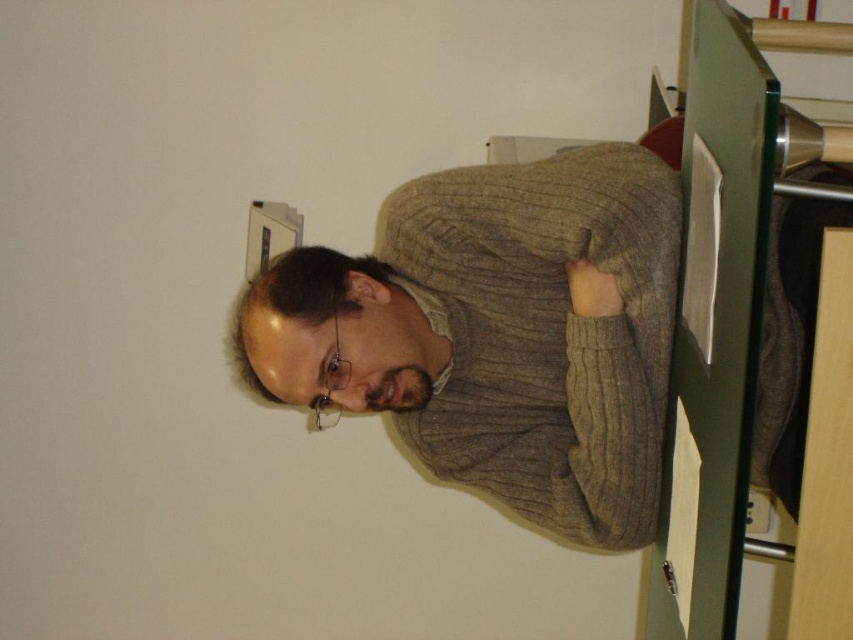
Question: Can you confirm if knitted sweater at center is positioned to the right of black plastic electric outlet at lower right?

Choices:
 (A) yes
 (B) no

Answer: (B)

Question: Which point is closer to the camera?

Choices:
 (A) black plastic electric outlet at lower right
 (B) knitted sweater at center

Answer: (B)

Question: Is knitted sweater at center thinner than black plastic electric outlet at lower right?

Choices:
 (A) no
 (B) yes

Answer: (A)

Question: Which point is farther from the camera taking this photo?

Choices:
 (A) (763, 504)
 (B) (351, 262)

Answer: (A)

Question: Does knitted sweater at center appear on the left side of black plastic electric outlet at lower right?

Choices:
 (A) no
 (B) yes

Answer: (B)

Question: Which object appears closest to the camera in this image?

Choices:
 (A) knitted sweater at center
 (B) black plastic electric outlet at lower right

Answer: (A)